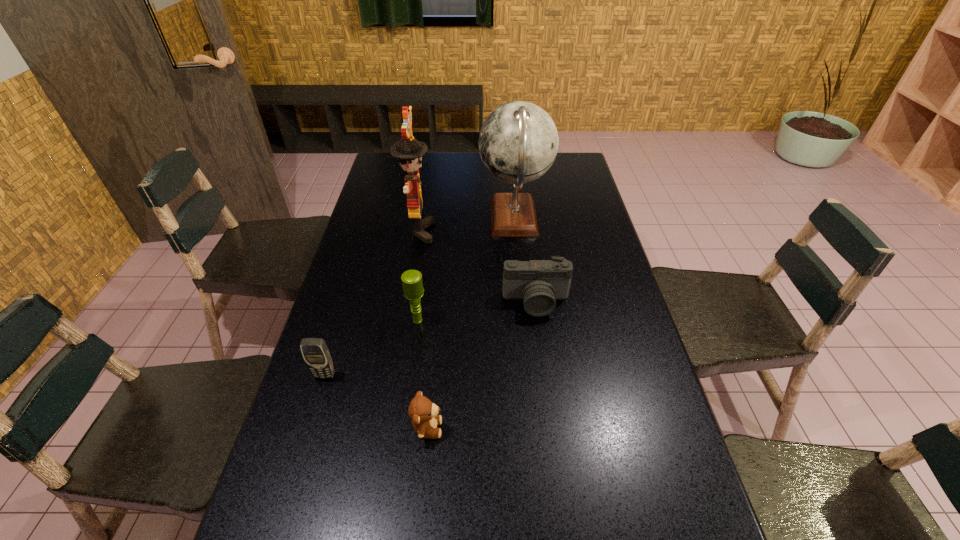
This screenshot has height=540, width=960. In order to click on free point located 0.130m at the equator of the globe in this screenshot , I will do `click(443, 218)`.

Where is `free spot located 0.180m at the equator of the globe`? The height and width of the screenshot is (540, 960). free spot located 0.180m at the equator of the globe is located at coordinates (429, 218).

Locate an element on the screen. Image resolution: width=960 pixels, height=540 pixels. vacant region located 0.350m on the front of the microphone is located at coordinates (401, 449).

Locate an element on the screen. vacant region located 0.280m on the front face of the cellular telephone is located at coordinates (288, 497).

Find the location of a particular element. free spot located at the lens of the camera is located at coordinates (546, 383).

Find the location of a particular element. This screenshot has width=960, height=540. free space located on the face of the teddy bear is located at coordinates (482, 428).

This screenshot has width=960, height=540. Identify the location of object that is at the left edge. (316, 354).

Identify the location of blank space at the left edge of the desktop. This screenshot has height=540, width=960. pos(384,280).

In the image, there is a desktop. In order to click on free space at the right edge in this screenshot , I will do `click(624, 322)`.

At what (x,y) coordinates should I click in order to perform the action: click on vacant space in between the camera and the fifth farthest object. Please return your answer as a coordinate pair (x, y). The image size is (960, 540). Looking at the image, I should click on (430, 339).